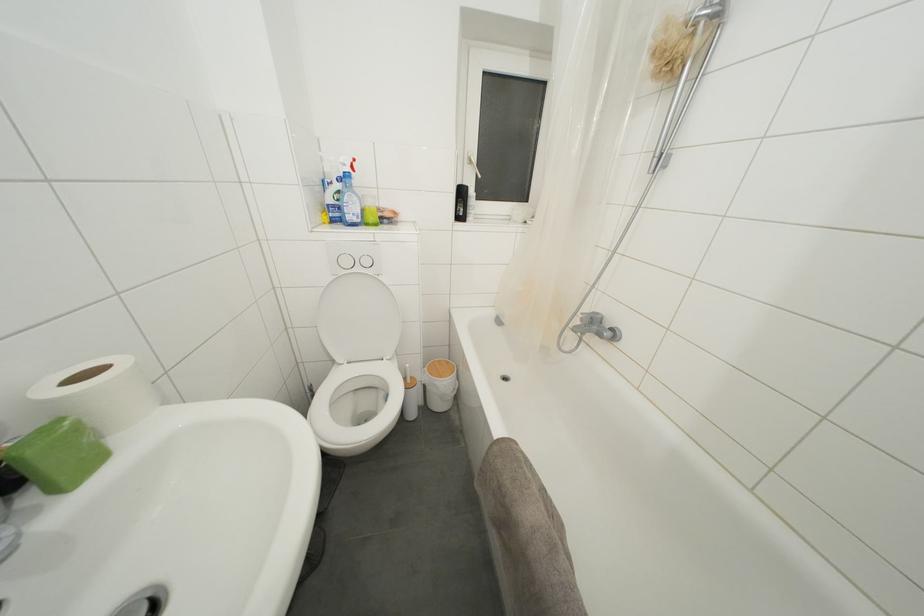
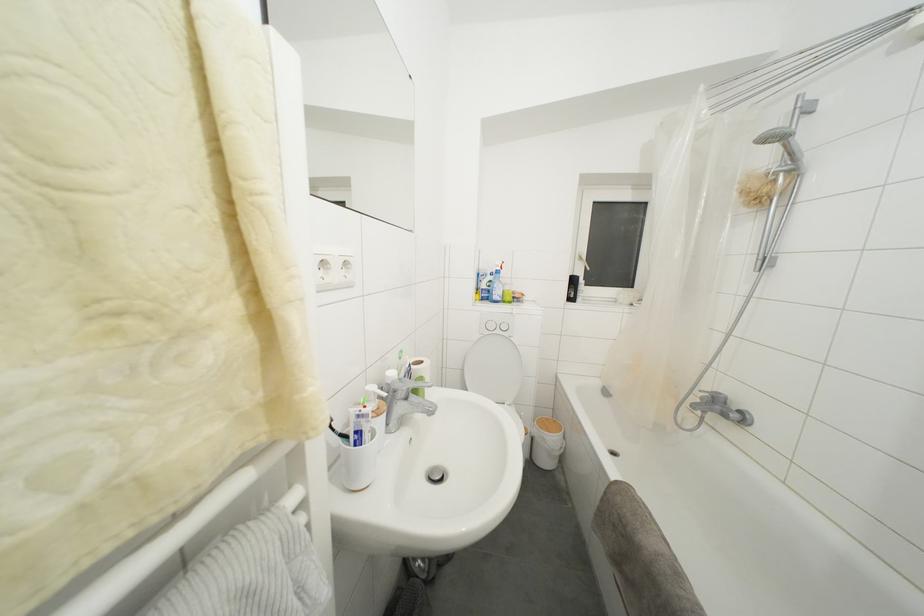
Where in the second image is the point corresponding to the point at 379,283 from the first image?

(513, 344)